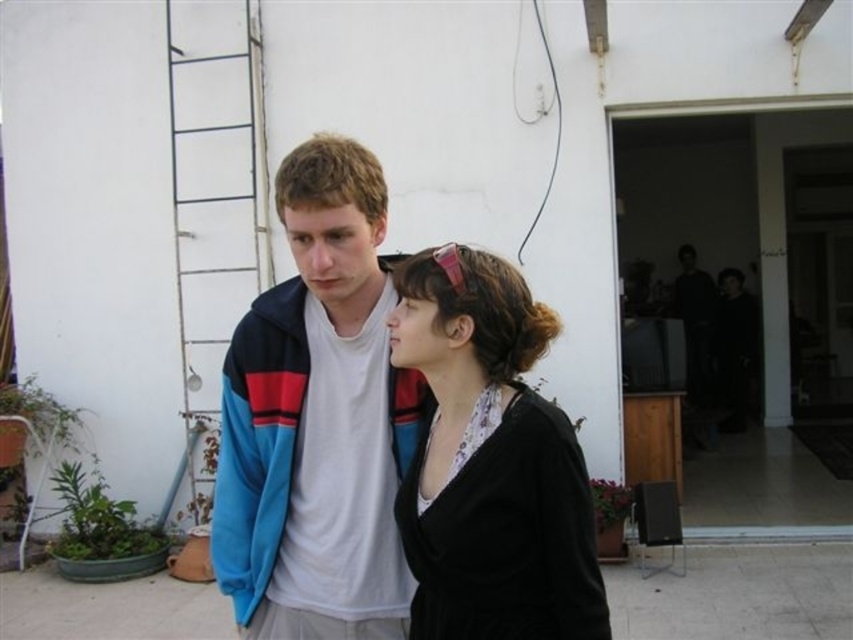
Consider the image. Does blue fleece jacket at center appear under black matte sweater at center?

Actually, blue fleece jacket at center is above black matte sweater at center.

Who is positioned more to the right, blue fleece jacket at center or black matte sweater at center?

black matte sweater at center

Image resolution: width=853 pixels, height=640 pixels. I want to click on blue fleece jacket at center, so click(x=317, y=419).